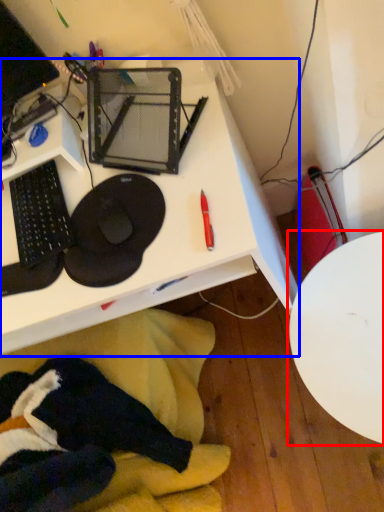
Question: Which object appears closest to the camera in this image, table (highlighted by a red box) or desk (highlighted by a blue box)?

Choices:
 (A) table
 (B) desk

Answer: (B)